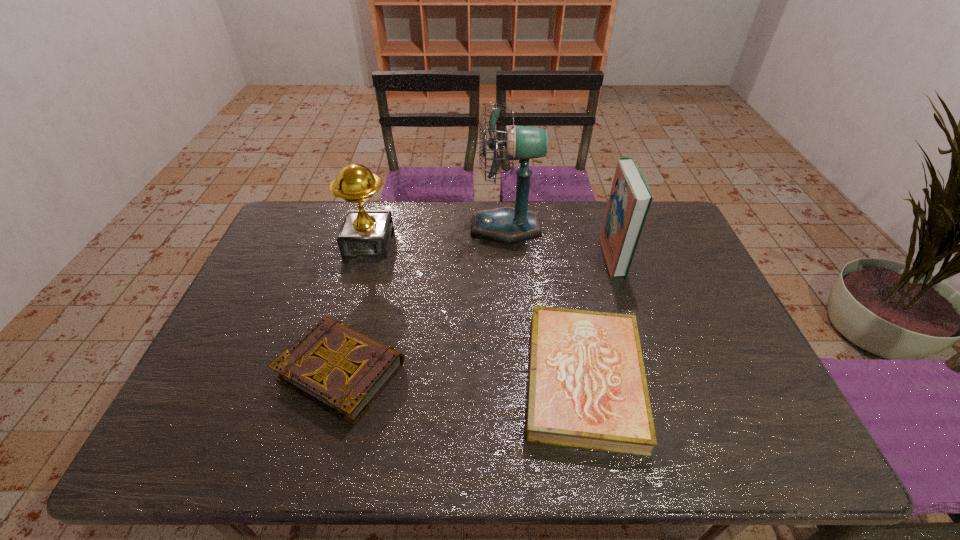
The width and height of the screenshot is (960, 540). In order to click on free space in the image that satisfies the following two spatial constraints: 1. in front of the tallest object where the wind blows; 2. on the front-facing side of the award in this screenshot , I will do `click(507, 242)`.